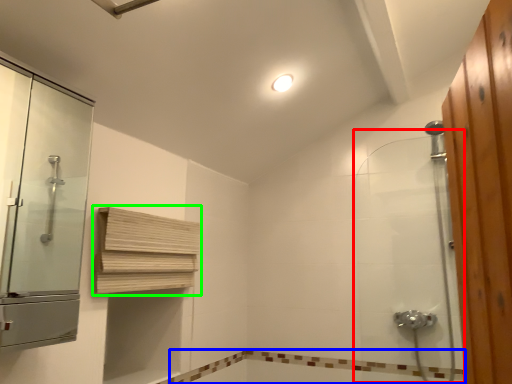
Question: Based on their relative distances, which object is farther from shower door (highlighted by a red box)? Choose from bath (highlighted by a blue box) and shelf (highlighted by a green box).

Choices:
 (A) bath
 (B) shelf

Answer: (B)